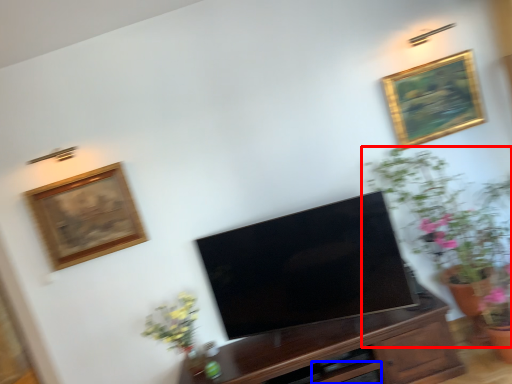
Question: Which of the following is the farthest to the observer, houseplant (highlighted by a red box) or drawer (highlighted by a blue box)?

Choices:
 (A) houseplant
 (B) drawer

Answer: (B)